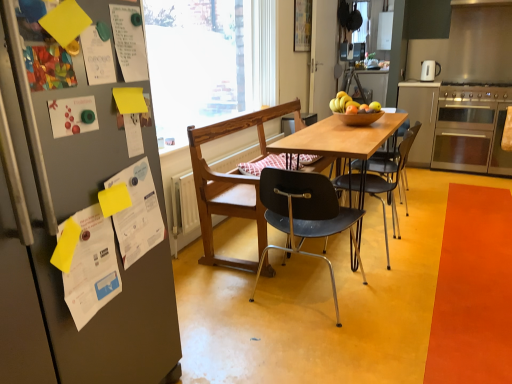
Question: In the image, is white glossy electric kettle at upper right positioned in front of or behind transparent glass window at center?

Choices:
 (A) behind
 (B) front

Answer: (A)

Question: Based on their sizes in the image, would you say white glossy electric kettle at upper right is bigger or smaller than transparent glass window at center?

Choices:
 (A) big
 (B) small

Answer: (B)

Question: Considering the real-world distances, which object is closest to the orange matte mat at lower right?

Choices:
 (A) wooden table at center
 (B) white glossy electric kettle at upper right
 (C) matte paper poster at left, the 2th poster when ordered from left to right
 (D) transparent glass window at center
 (E) white paper at upper left, acting as the 6th poster starting from the bottom

Answer: (A)

Question: Estimate the real-world distances between objects in this image. Which object is closer to the white glossy electric kettle at upper right?

Choices:
 (A) stainless steel oven at right
 (B) white paper at upper left, which is counted as the 5th poster, starting from the bottom
 (C) black plastic chair at center, positioned as the third chair in front-to-back order
 (D) wooden table at center
 (E) black plastic chair at center, which appears as the 3th chair when viewed from the back

Answer: (A)